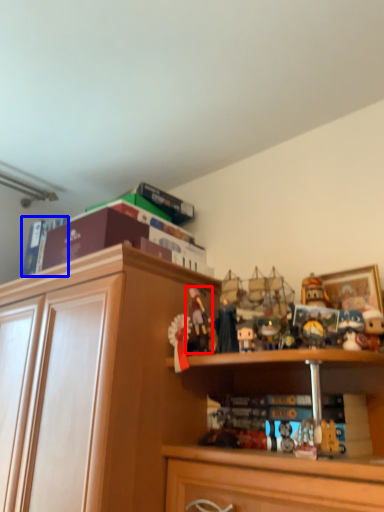
Question: Which object appears farthest to the camera in this image, toy (highlighted by a red box) or book (highlighted by a blue box)?

Choices:
 (A) toy
 (B) book

Answer: (B)